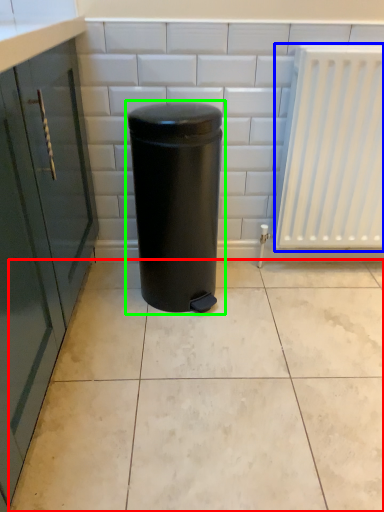
Question: Based on their relative distances, which object is nearer to ceramic tile (highlighted by a red box)? Choose from radiator (highlighted by a blue box) and waste container (highlighted by a green box).

Choices:
 (A) radiator
 (B) waste container

Answer: (B)